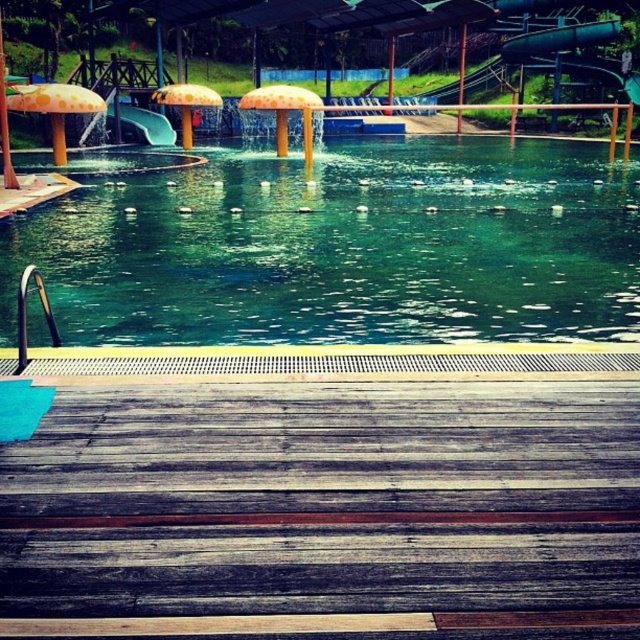
Between point (60, 241) and point (163, 125), which one is positioned in front?

Point (60, 241)

Is green glossy water at center positioned in front of green rubber slide at upper left?

Yes, green glossy water at center is in front of green rubber slide at upper left.

In order to click on green glossy water at center in this screenshot , I will do `click(344, 248)`.

Can you confirm if green rubber slide at upper left is positioned above yellow matte umbrella at center?

Incorrect, green rubber slide at upper left is not positioned above yellow matte umbrella at center.

Which of these two, green rubber slide at upper left or yellow matte umbrella at center, stands shorter?

green rubber slide at upper left

Is point (118, 108) more distant than point (161, 104)?

Yes, it is behind point (161, 104).

Where is `green rubber slide at upper left`? The width and height of the screenshot is (640, 640). green rubber slide at upper left is located at coordinates (141, 124).

This screenshot has width=640, height=640. I want to click on green glossy water at center, so pos(344,248).

Is green glossy water at center closer to camera compared to yellow matte umbrella at center?

Yes.

At what (x,y) coordinates should I click in order to perform the action: click on green glossy water at center. Please return your answer as a coordinate pair (x, y). Looking at the image, I should click on (344, 248).